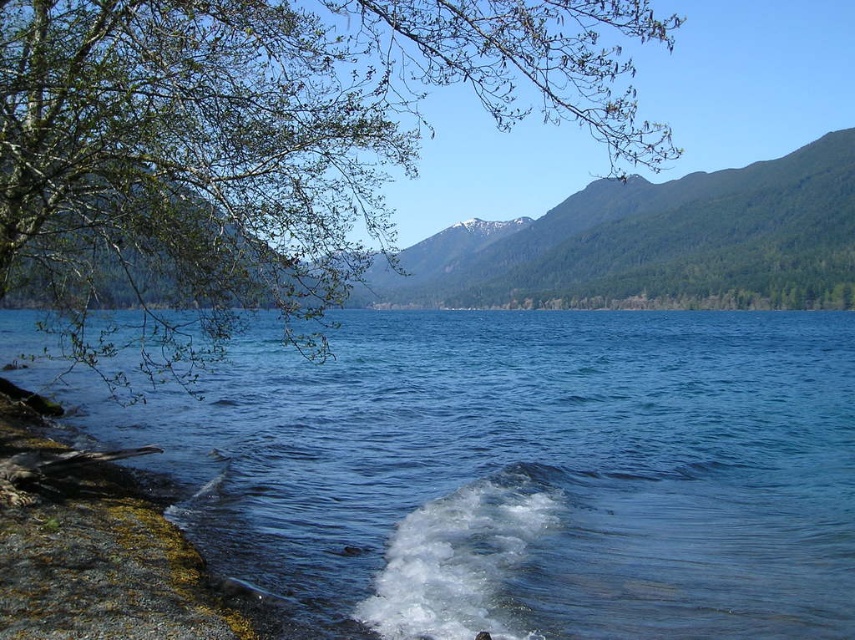
Question: Is green forested mountain at upper center further to camera compared to smooth rock shore at lower left?

Choices:
 (A) yes
 (B) no

Answer: (A)

Question: Which of the following is the closest to the observer?

Choices:
 (A) clear blue water at lower left
 (B) smooth rock shore at lower left
 (C) green leafy tree at upper left

Answer: (B)

Question: Is clear blue water at lower left behind green leafy tree at upper left?

Choices:
 (A) no
 (B) yes

Answer: (B)

Question: Which point is closer to the camera taking this photo?

Choices:
 (A) (617, 193)
 (B) (1, 38)
 (C) (66, 493)

Answer: (C)

Question: Estimate the real-world distances between objects in this image. Which object is closer to the green forested mountain at upper center?

Choices:
 (A) smooth rock shore at lower left
 (B) green leafy tree at upper left

Answer: (B)

Question: Does clear blue water at lower left have a smaller size compared to smooth rock shore at lower left?

Choices:
 (A) yes
 (B) no

Answer: (B)